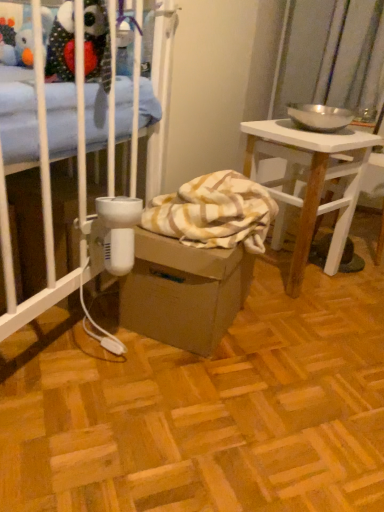
Find the location of a particular element. Image resolution: width=384 pixels, height=512 pixels. blank space above white wood desk at right (from a real-world perspective) is located at coordinates (314, 132).